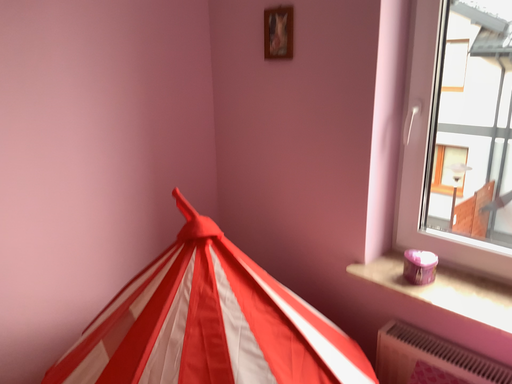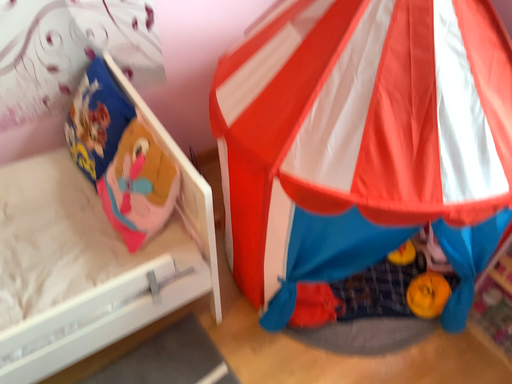
Question: Which way did the camera rotate in the video?

Choices:
 (A) rotated left
 (B) rotated right

Answer: (A)